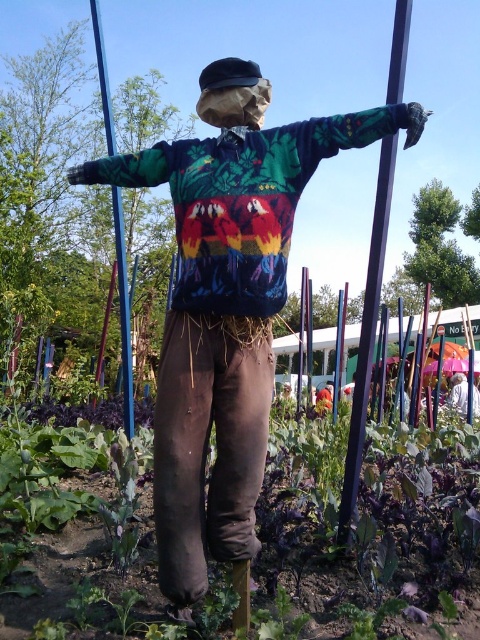
You are a gardener who wants to place a new decorative item between the purple glossy pole at center and the green plastic pole at center. Which pole should you place it closer to if you want the item to be near the smaller one?

You should place the new decorative item closer to the purple glossy pole at center because it occupies less space than the green plastic pole at center, making it the smaller one.

You are a gardener who wants to place a new flower pot exactly at the center of the garden bed. The garden bed is represented by the area around the green plastic pole at center. Where should you place the flower pot?

The green plastic pole at center is located at point 2D coordinates of (x=123, y=314), so you should place the flower pot at that exact point to ensure it is at the center of the garden bed.

You are a gardener who wants to hang a bird feeder on the object that is taller between the woolen sweater at center and the green plastic pole at center. Which object should you choose?

The green plastic pole at center is taller than the woolen sweater at center, so you should choose the green plastic pole at center to hang the bird feeder.